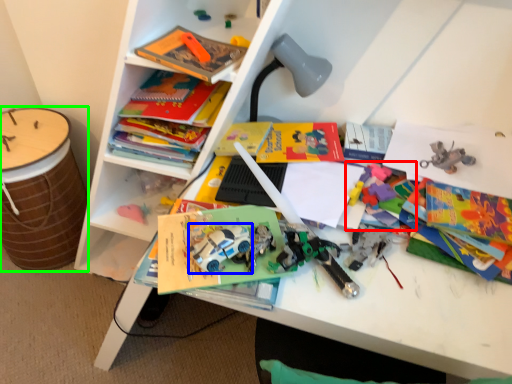
Question: Based on their relative distances, which object is farther from toy (highlighted by a red box)? Choose from toy car (highlighted by a blue box) and drum (highlighted by a green box).

Choices:
 (A) toy car
 (B) drum

Answer: (B)